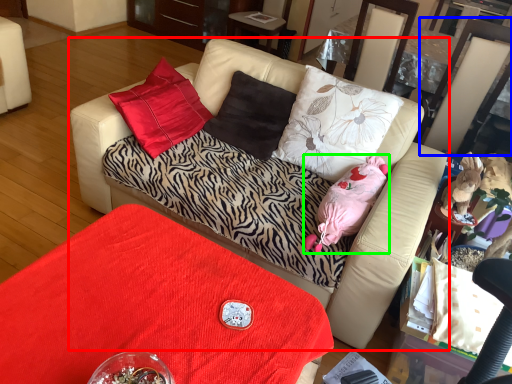
Question: Which object is the farthest from studio couch (highlighted by a red box)? Choose among these: swivel chair (highlighted by a blue box) or animal (highlighted by a green box).

Choices:
 (A) swivel chair
 (B) animal

Answer: (A)